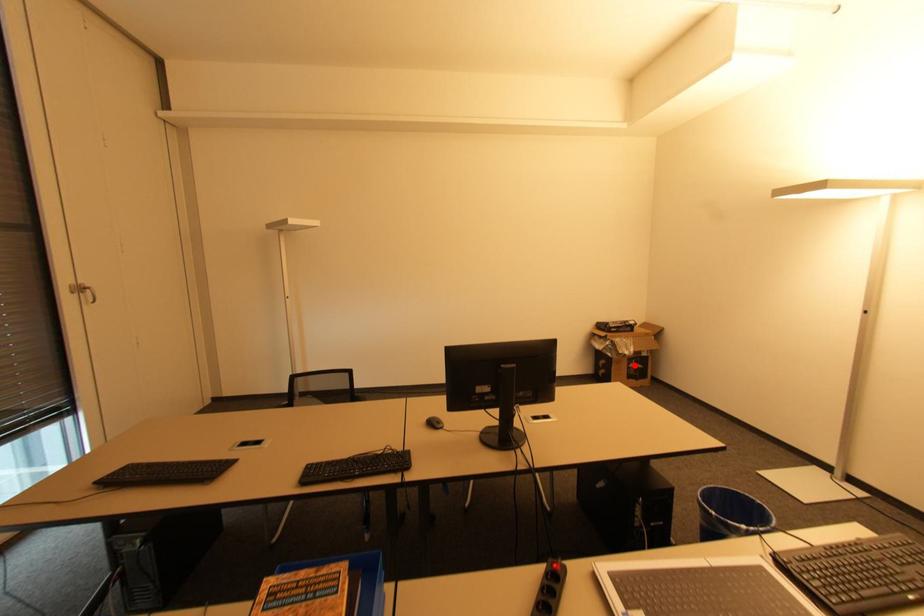
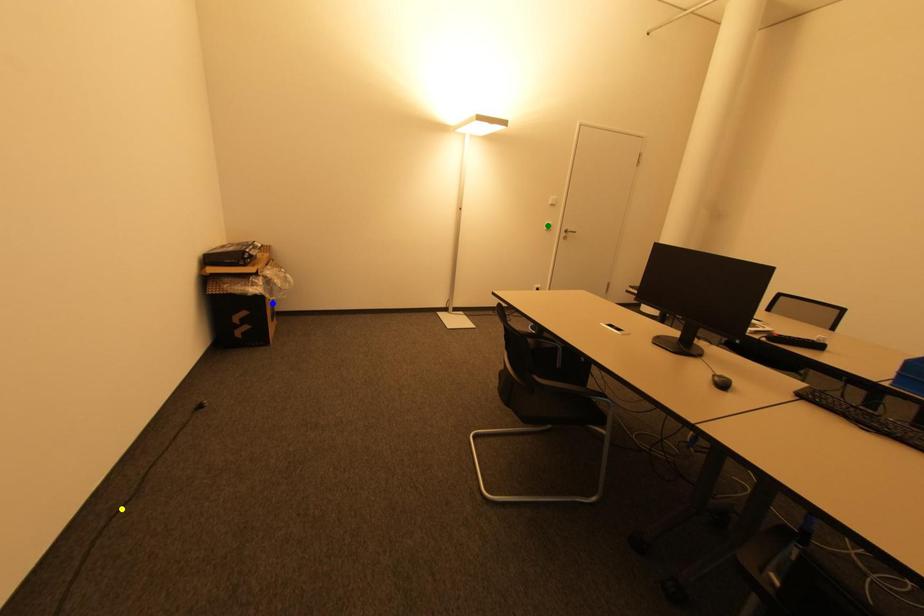
Question: I am providing you with two images of the same scene from different viewpoints. A red point is marked on the first image. You are given multiple points on the second image. Which point in image 2 is actually the same real-world point as the red point in image 1?

Choices:
 (A) yellow point
 (B) green point
 (C) blue point

Answer: (C)